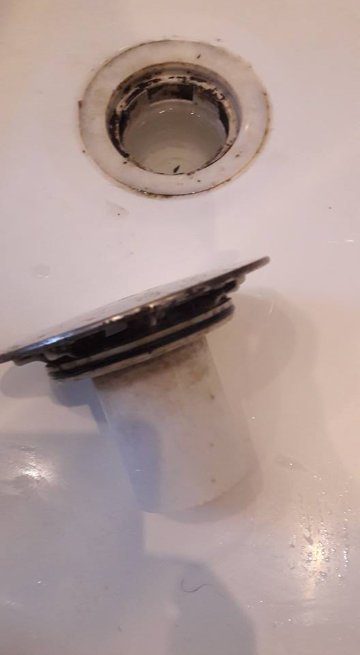
Locate an element on the screen. The image size is (360, 655). white cylinder connected to the top of the drain cover is located at coordinates (177, 441).